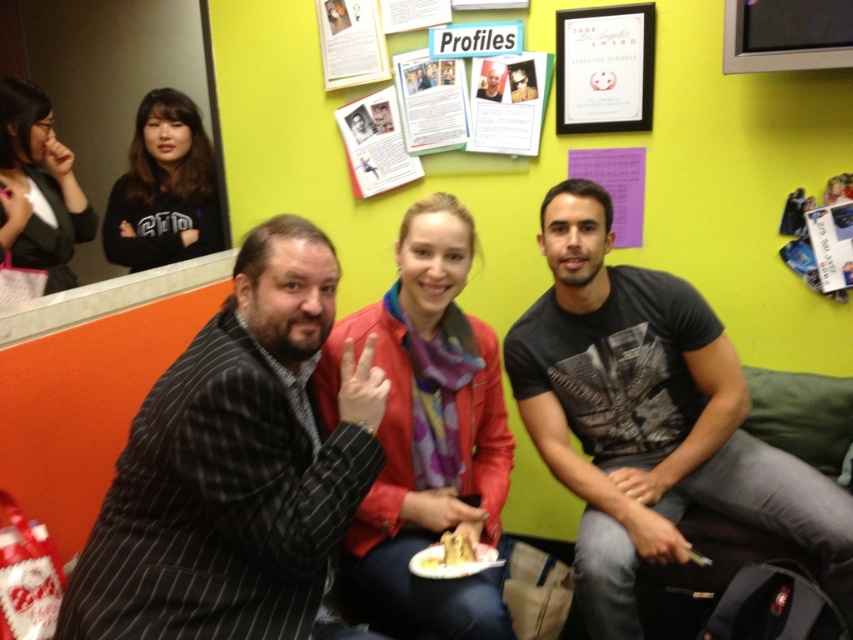
Who is positioned more to the right, matte paper poster at upper center or yellow crumbly cake at center?

From the viewer's perspective, yellow crumbly cake at center appears more on the right side.

Does matte paper poster at upper center appear on the left side of yellow crumbly cake at center?

Yes, matte paper poster at upper center is to the left of yellow crumbly cake at center.

Does point (413, 97) come farther from viewer compared to point (451, 552)?

Yes, it is behind point (451, 552).

Where is `matte paper poster at upper center`? The height and width of the screenshot is (640, 853). matte paper poster at upper center is located at coordinates (431, 100).

Who is shorter, matte paper poster at upper center or white paper plate at center?

white paper plate at center

Who is more forward, (415, 51) or (465, 572)?

Point (465, 572) is more forward.

Image resolution: width=853 pixels, height=640 pixels. What do you see at coordinates (431, 100) in the screenshot?
I see `matte paper poster at upper center` at bounding box center [431, 100].

At what (x,y) coordinates should I click in order to perform the action: click on matte paper poster at upper center. Please return your answer as a coordinate pair (x, y). The height and width of the screenshot is (640, 853). Looking at the image, I should click on (431, 100).

Does black matte shirt at upper left have a greater width compared to yellow crumbly cake at center?

Indeed, black matte shirt at upper left has a greater width compared to yellow crumbly cake at center.

Is black matte shirt at upper left below yellow crumbly cake at center?

Incorrect, black matte shirt at upper left is not positioned below yellow crumbly cake at center.

Image resolution: width=853 pixels, height=640 pixels. Find the location of `black matte shirt at upper left`. black matte shirt at upper left is located at coordinates (164, 188).